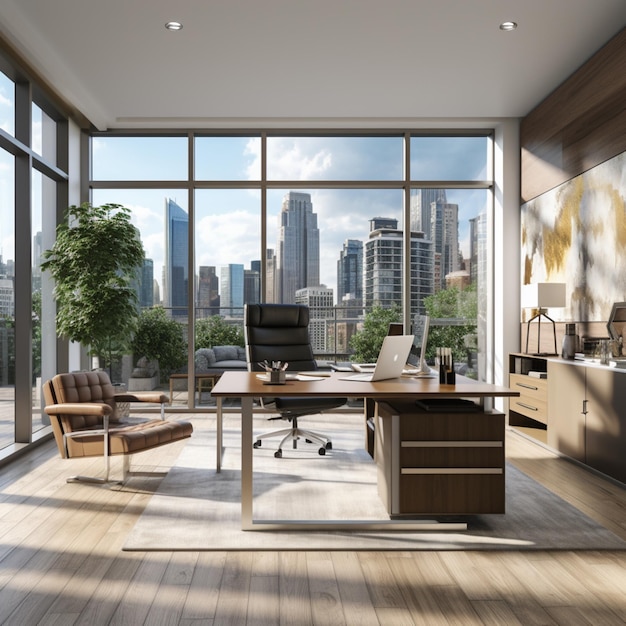
The height and width of the screenshot is (626, 626). Identify the location of brown couch. (130, 439), (96, 386).